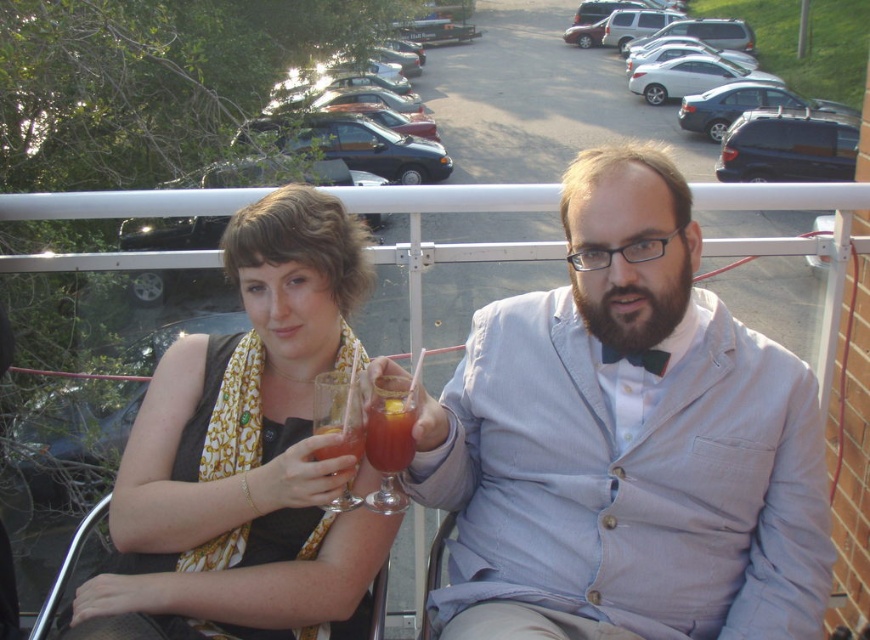
Question: Which of the following is the closest to the observer?

Choices:
 (A) (837, 61)
 (B) (328, 433)

Answer: (B)

Question: Which point is farther to the camera?

Choices:
 (A) (345, 276)
 (B) (315, 172)
 (C) (353, 438)

Answer: (B)

Question: Observing the image, what is the correct spatial positioning of matte gold scarf at center in reference to shiny black sedan at upper left?

Choices:
 (A) right
 (B) left

Answer: (A)

Question: Is translucent glass wine glass at center wider than translucent glass at center?

Choices:
 (A) yes
 (B) no

Answer: (B)

Question: Where is matte gold scarf at center located in relation to translucent glass wine glass at center in the image?

Choices:
 (A) above
 (B) below

Answer: (A)

Question: Which point is closer to the camera taking this photo?

Choices:
 (A) (306, 164)
 (B) (393, 477)
 (C) (817, 33)
 (D) (236, 269)

Answer: (B)